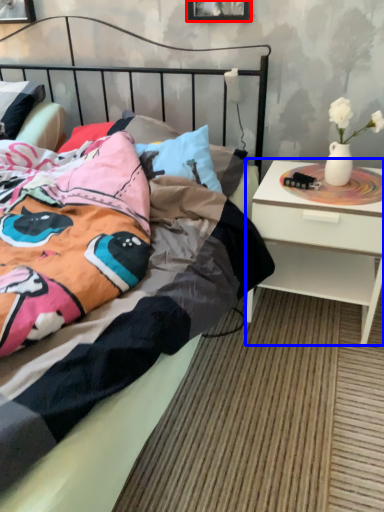
Question: Which of the following is the closest to the observer, picture frame (highlighted by a red box) or nightstand (highlighted by a blue box)?

Choices:
 (A) picture frame
 (B) nightstand

Answer: (B)